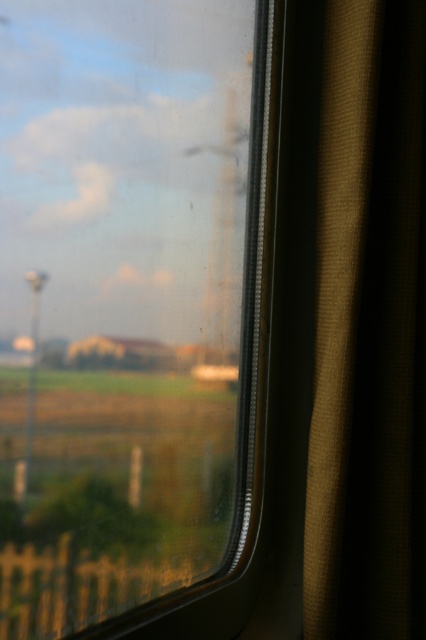
Looking at this image, you are a passenger sitting inside a train and want to look outside through the transparent glass train window at center. Where exactly should you look on the window to see the outside clearly?

You should look at the point located at coordinates 0.472 on the x axis and 0.293 on the y axis of the transparent glass train window at center to see the outside clearly.

You are a passenger sitting by the window in a train. You want to look outside through the transparent glass train window at center but the brown textured curtain at right is blocking your view. Can you move the curtain to the right to get a clear view?

The transparent glass train window at center is to the left of brown textured curtain at right, so moving the brown textured curtain at right to the right would allow you to see through the transparent glass train window at center without obstruction.

You are sitting inside a train and looking through the window. There is a point marked at coordinates (124, 301). What is located at that point?

The point (124, 301) marks the transparent glass train window at center.